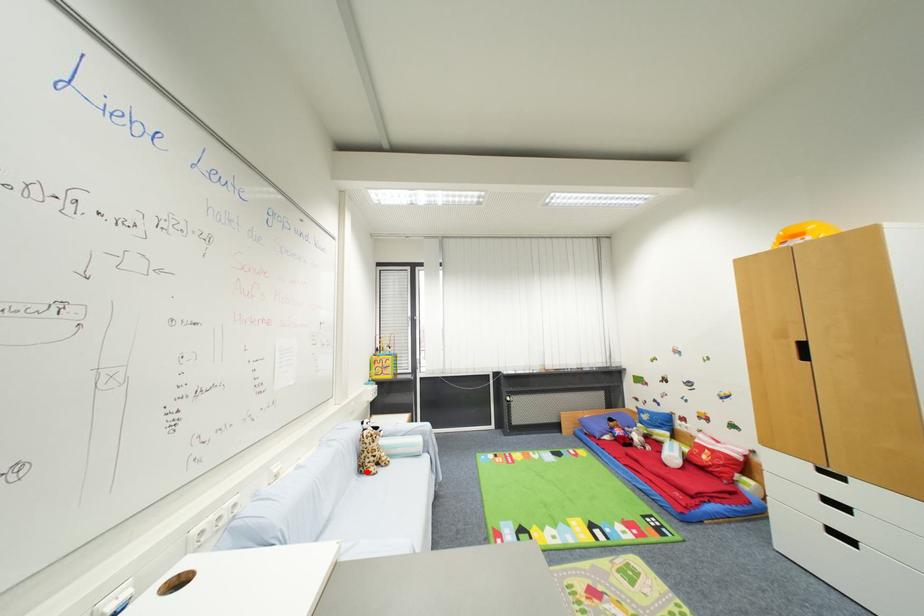
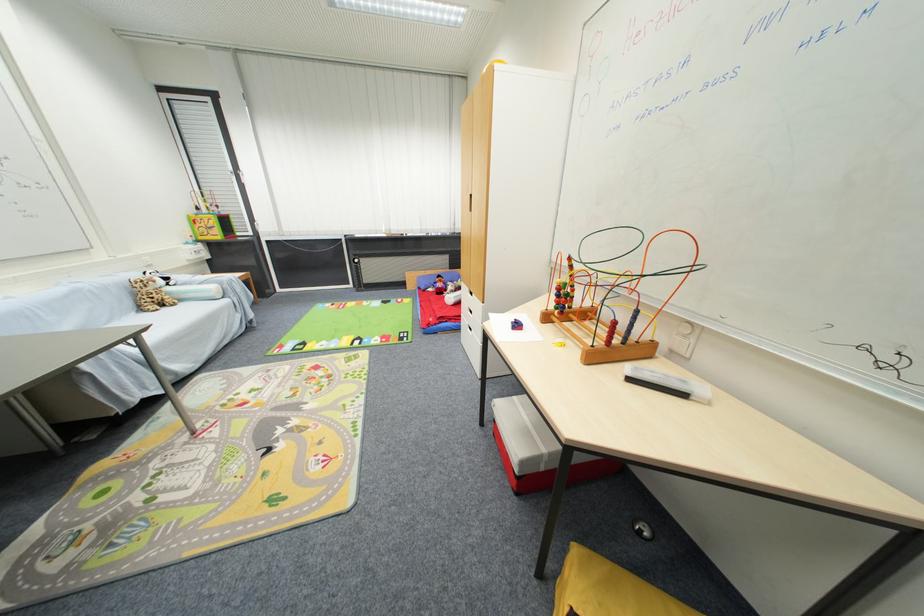
The point at the highlighted location is marked in the first image. Where is the corresponding point in the second image?

(146, 310)